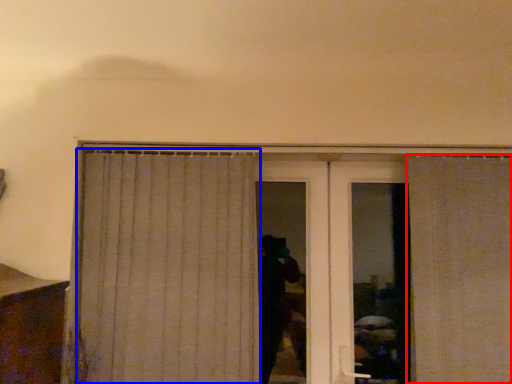
Question: Which object is further to the camera taking this photo, curtain (highlighted by a red box) or curtain (highlighted by a blue box)?

Choices:
 (A) curtain
 (B) curtain

Answer: (B)